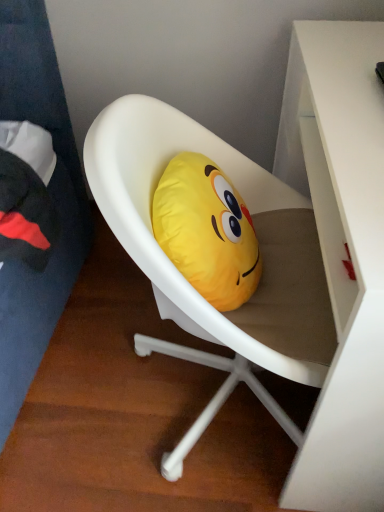
Image resolution: width=384 pixels, height=512 pixels. What do you see at coordinates (341, 252) in the screenshot? I see `white glossy desk at upper right` at bounding box center [341, 252].

The width and height of the screenshot is (384, 512). Find the location of `white glossy desk at upper right`. white glossy desk at upper right is located at coordinates 341,252.

From the picture: From a real-world perspective, is white glossy desk at upper right positioned above or below yellow fabric emoji pillow at center?

From a real-world perspective, white glossy desk at upper right is physically below yellow fabric emoji pillow at center.

Is white glossy desk at upper right to the left of yellow fabric emoji pillow at center from the viewer's perspective?

No, white glossy desk at upper right is not to the left of yellow fabric emoji pillow at center.

Which of these two, white glossy desk at upper right or yellow fabric emoji pillow at center, is thinner?

yellow fabric emoji pillow at center is thinner.

Does point (344, 388) lie in front of point (189, 215)?

Yes, point (344, 388) is in front of point (189, 215).

How distant is white matte chair at center from white glossy desk at upper right?

white matte chair at center is 8.74 inches away from white glossy desk at upper right.

From a real-world perspective, is white matte chair at center positioned above or below white glossy desk at upper right?

From a real-world perspective, white matte chair at center is physically above white glossy desk at upper right.

Could you tell me if white matte chair at center is facing white glossy desk at upper right?

Yes, white matte chair at center is facing white glossy desk at upper right.

Which of these two, white matte chair at center or white glossy desk at upper right, is wider?

With larger width is white matte chair at center.

Is point (280, 364) farther from viewer compared to point (222, 290)?

No, it is in front of (222, 290).

Does white matte chair at center turn towards yellow fabric emoji pillow at center?

Yes, white matte chair at center faces towards yellow fabric emoji pillow at center.

Is white matte chair at center shorter than yellow fabric emoji pillow at center?

In fact, white matte chair at center may be taller than yellow fabric emoji pillow at center.

Looking at this image, can you confirm if yellow fabric emoji pillow at center is wider than white glossy desk at upper right?

In fact, yellow fabric emoji pillow at center might be narrower than white glossy desk at upper right.

How many degrees apart are the facing directions of yellow fabric emoji pillow at center and white glossy desk at upper right?

180 degrees.

Looking at the image, does yellow fabric emoji pillow at center seem bigger or smaller compared to white glossy desk at upper right?

In the image, yellow fabric emoji pillow at center appears to be smaller than white glossy desk at upper right.

From a real-world perspective, between yellow fabric emoji pillow at center and white glossy desk at upper right, who is vertically higher?

In real-world perspective, yellow fabric emoji pillow at center is above.

Is yellow fabric emoji pillow at center positioned with its back to white matte chair at center?

That's right, yellow fabric emoji pillow at center is facing away from white matte chair at center.

Considering the positions of point (176, 208) and point (298, 323), is point (176, 208) closer or farther from the camera than point (298, 323)?

Clearly, point (176, 208) is closer to the camera than point (298, 323).

Considering the relative sizes of yellow fabric emoji pillow at center and white matte chair at center in the image provided, is yellow fabric emoji pillow at center taller than white matte chair at center?

No, yellow fabric emoji pillow at center is not taller than white matte chair at center.

Is white matte chair at center inside white glossy desk at upper right?

Yes, white matte chair at center is a part of white glossy desk at upper right.

Considering the points (342, 176) and (292, 327), which point is in front, point (342, 176) or point (292, 327)?

The point (342, 176) is closer.

From the image's perspective, which one is positioned higher, white glossy desk at upper right or white matte chair at center?

white glossy desk at upper right.

Find the location of a particular element. desk on the right side of yellow fabric emoji pillow at center is located at coordinates (341, 252).

Identify the location of desk lying above the white matte chair at center (from the image's perspective). Image resolution: width=384 pixels, height=512 pixels. (341, 252).

Which object lies further to the anchor point yellow fabric emoji pillow at center, white matte chair at center or white glossy desk at upper right?

white glossy desk at upper right.

Considering their positions, is yellow fabric emoji pillow at center positioned closer to white glossy desk at upper right than white matte chair at center?

white matte chair at center lies closer to white glossy desk at upper right than the other object.

When comparing their distances from yellow fabric emoji pillow at center, does white glossy desk at upper right or white matte chair at center seem closer?

white matte chair at center is closer to yellow fabric emoji pillow at center.

From the image, which object appears to be nearer to white glossy desk at upper right, white matte chair at center or yellow fabric emoji pillow at center?

white matte chair at center lies closer to white glossy desk at upper right than the other object.

From the image, which object appears to be farther from white matte chair at center, yellow fabric emoji pillow at center or white glossy desk at upper right?

Based on the image, white glossy desk at upper right appears to be further to white matte chair at center.

From the picture: From the image, which object appears to be farther from white matte chair at center, white glossy desk at upper right or yellow fabric emoji pillow at center?

white glossy desk at upper right lies further to white matte chair at center than the other object.

Locate an element on the screen. This screenshot has height=512, width=384. chair located between yellow fabric emoji pillow at center and white glossy desk at upper right in the left-right direction is located at coordinates point(187,281).